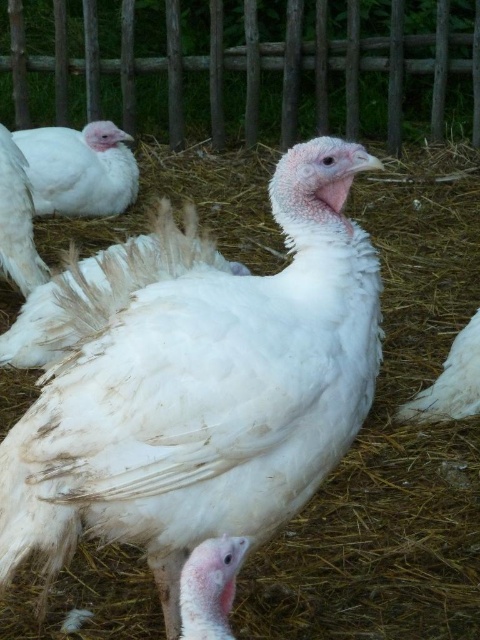
Does wooden fence at upper center appear under white feathered chicken at lower right?

No, wooden fence at upper center is not below white feathered chicken at lower right.

At what (x,y) coordinates should I click in order to perform the action: click on wooden fence at upper center. Please return your answer as a coordinate pair (x, y). The image size is (480, 640). Looking at the image, I should click on (244, 67).

Does point (36, 20) come in front of point (440, 401)?

No, it is not.

Image resolution: width=480 pixels, height=640 pixels. Find the location of `wooden fence at upper center`. wooden fence at upper center is located at coordinates (244, 67).

Is wooden fence at upper center positioned behind white feathered chicken at left?

Yes, it is.

Can you confirm if wooden fence at upper center is positioned above white feathered chicken at left?

Indeed, wooden fence at upper center is positioned over white feathered chicken at left.

Find the location of a particular element. This screenshot has height=640, width=480. wooden fence at upper center is located at coordinates (244, 67).

Between white feathered turkey at center and white feathered turkey at left, which one has more height?

Standing taller between the two is white feathered turkey at center.

Does white feathered turkey at center lie in front of white feathered turkey at left?

Yes, it is.

Who is more forward, (172,333) or (49,147)?

Point (172,333)

Locate an element on the screen. The height and width of the screenshot is (640, 480). white feathered turkey at center is located at coordinates (207, 394).